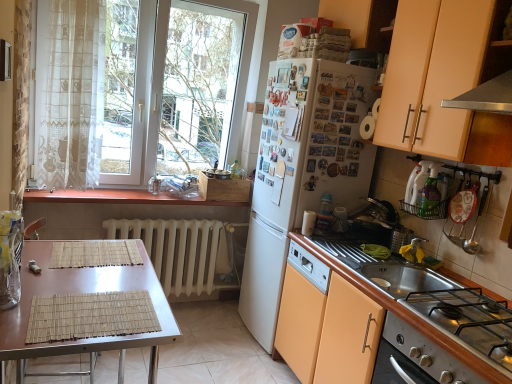
Find the location of a particular element. free space behind clear glass jar at left is located at coordinates (37, 275).